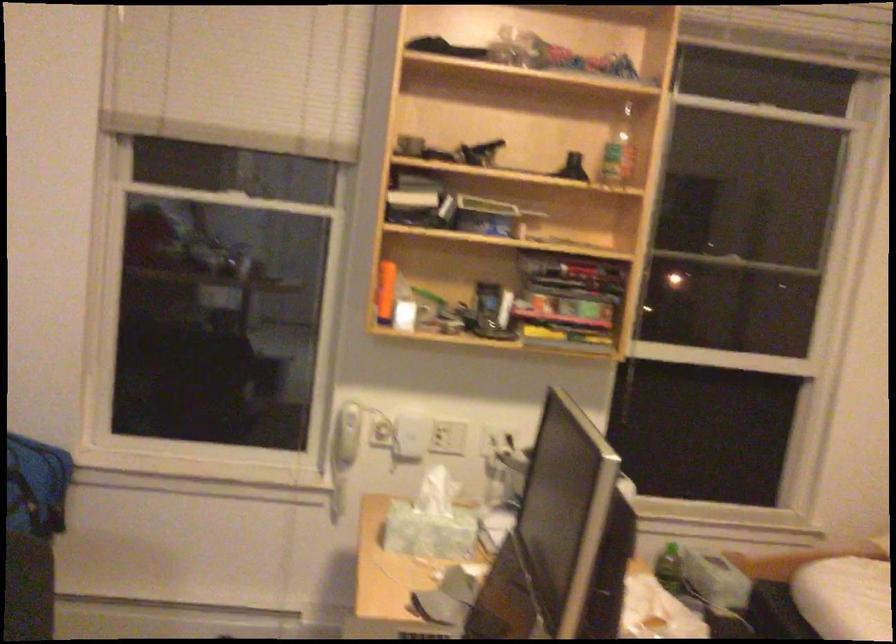
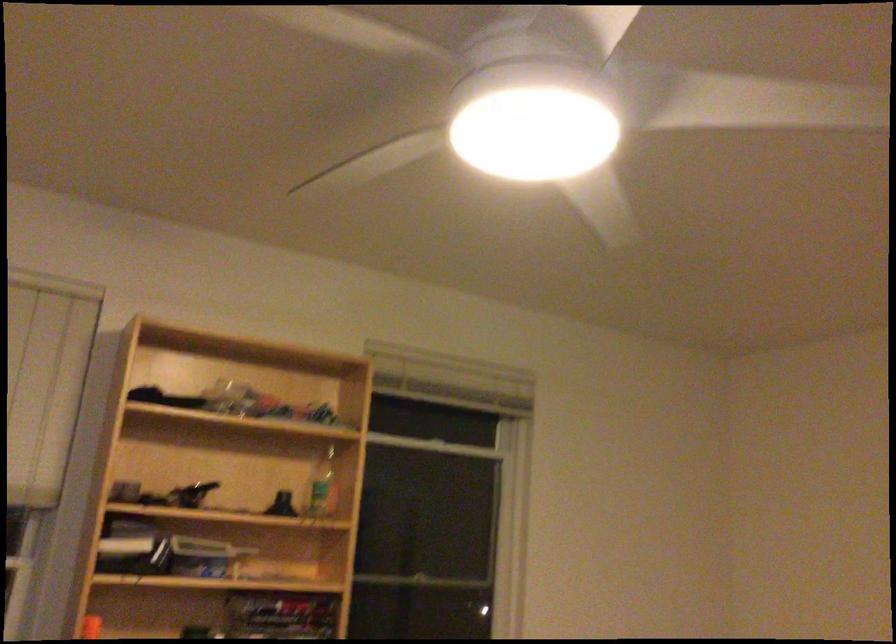
The first image is from the beginning of the video and the second image is from the end. How did the camera likely rotate when shooting the video?

The camera's rotation is toward right-up.